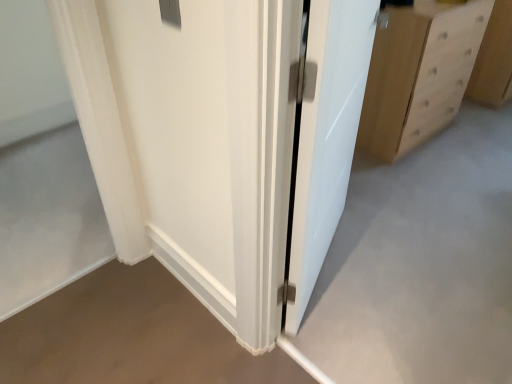
Question: Is white sheer curtain at left behind white glossy door at center?

Choices:
 (A) yes
 (B) no

Answer: (A)

Question: From a real-world perspective, is white sheer curtain at left below white glossy door at center?

Choices:
 (A) no
 (B) yes

Answer: (B)

Question: From the image's perspective, would you say white sheer curtain at left is shown under white glossy door at center?

Choices:
 (A) yes
 (B) no

Answer: (A)

Question: Does white sheer curtain at left have a larger size compared to white glossy door at center?

Choices:
 (A) yes
 (B) no

Answer: (B)

Question: Does white sheer curtain at left appear on the right side of white glossy door at center?

Choices:
 (A) yes
 (B) no

Answer: (B)

Question: Is point (458, 18) positioned closer to the camera than point (391, 109)?

Choices:
 (A) closer
 (B) farther

Answer: (A)

Question: Which is correct: light wood drawer at right is inside light brown wood chest of drawers at right, or outside of it?

Choices:
 (A) inside
 (B) outside

Answer: (B)

Question: Is light wood drawer at right wider or thinner than light brown wood chest of drawers at right?

Choices:
 (A) wide
 (B) thin

Answer: (A)

Question: Is light wood drawer at right taller or shorter than light brown wood chest of drawers at right?

Choices:
 (A) tall
 (B) short

Answer: (B)

Question: From a real-world perspective, relative to white sheer curtain at left, is white glossy door at center vertically above or below?

Choices:
 (A) above
 (B) below

Answer: (A)

Question: Is white glossy door at center inside or outside of white sheer curtain at left?

Choices:
 (A) outside
 (B) inside

Answer: (A)

Question: Considering the positions of white glossy door at center and white sheer curtain at left in the image, is white glossy door at center taller or shorter than white sheer curtain at left?

Choices:
 (A) tall
 (B) short

Answer: (A)

Question: From the image's perspective, is white glossy door at center positioned above or below white sheer curtain at left?

Choices:
 (A) above
 (B) below

Answer: (A)

Question: Is point (315, 208) positioned closer to the camera than point (413, 56)?

Choices:
 (A) closer
 (B) farther

Answer: (A)

Question: From the image's perspective, is white glossy door at center positioned above or below light brown wood chest of drawers at right?

Choices:
 (A) below
 (B) above

Answer: (A)